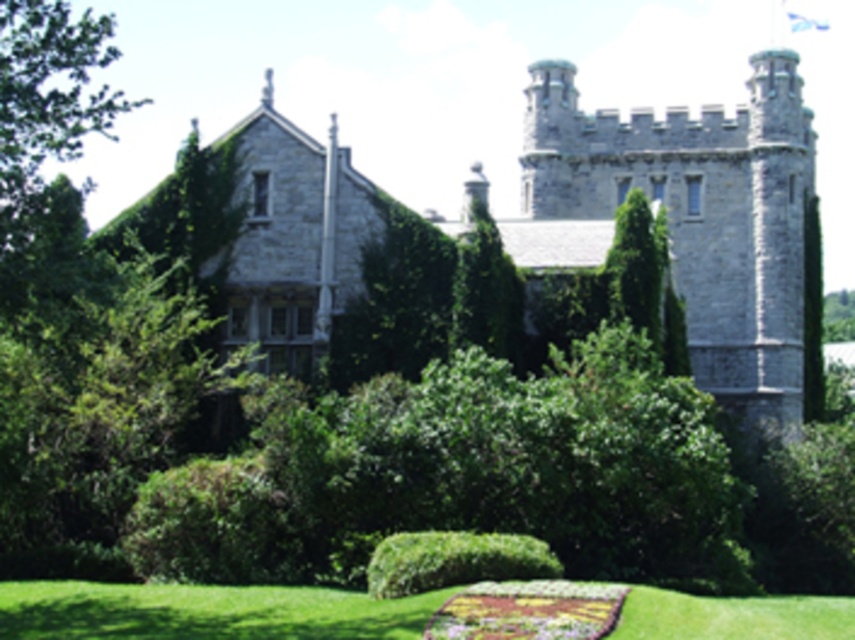
You are a gardener planning to plant a new flower bed between the green grass at lower center and the multicolored fabric flower at lower center. Which side should you place the new flowers to ensure they are aligned with the existing layout?

The green grass at lower center is positioned on the left side of multicolored fabric flower at lower center, so you should plant the new flowers to the right of the green grass at lower center to maintain alignment with the existing layout.

You are standing in the garden in front of the stone castle at center. If you walk straight ahead from your current position, will you eventually reach the castle?

Yes, because the stone castle at center is positioned at point (687, 216), which is directly ahead in the center of the scene, so walking straight would lead you towards it.